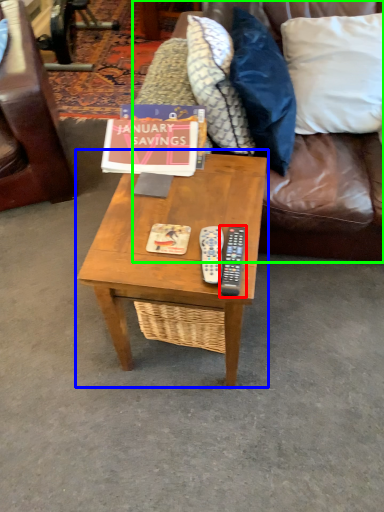
Question: Based on their relative distances, which object is nearer to remote (highlighted by a red box)? Choose from coffee table (highlighted by a blue box) and studio couch (highlighted by a green box).

Choices:
 (A) coffee table
 (B) studio couch

Answer: (A)